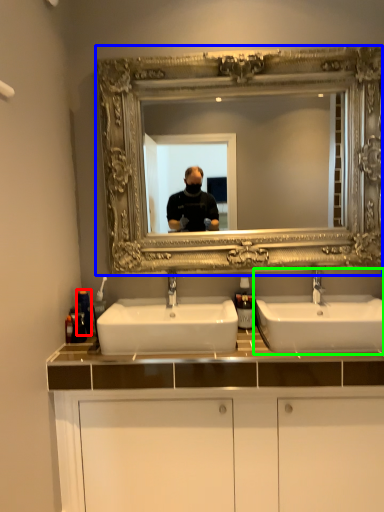
Question: Which object is positioned closest to toiletry (highlighted by a red box)? Select from medicine cabinet (highlighted by a blue box) and sink (highlighted by a green box).

Choices:
 (A) medicine cabinet
 (B) sink

Answer: (A)